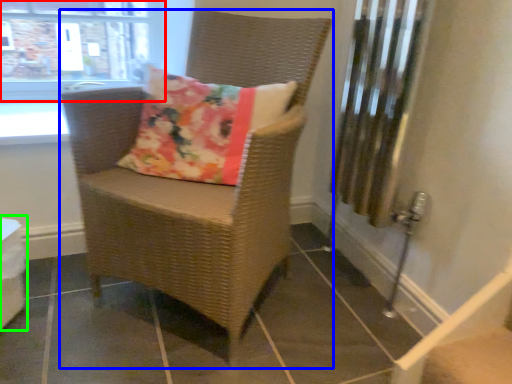
Question: Considering the real-world distances, which object is farthest from window (highlighted by a red box)? chair (highlighted by a blue box) or table (highlighted by a green box)?

Choices:
 (A) chair
 (B) table

Answer: (B)